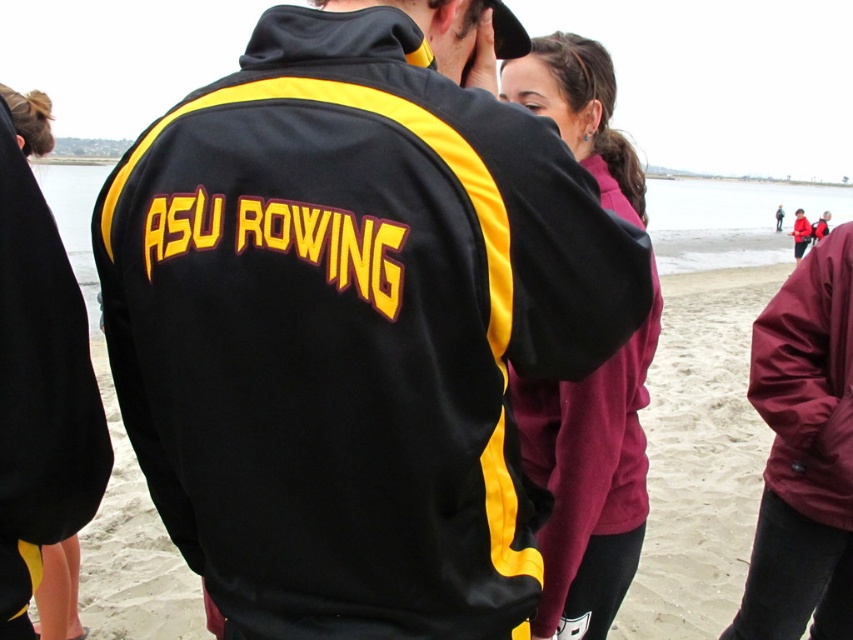
Between black/yellow track jacket at center and maroon fabric jacket at right, which one appears on the left side from the viewer's perspective?

black/yellow track jacket at center is more to the left.

Is black/yellow track jacket at center smaller than maroon fabric jacket at right?

Actually, black/yellow track jacket at center might be larger than maroon fabric jacket at right.

Is point (310, 358) farther from viewer compared to point (820, 262)?

No, it is not.

Where is `black/yellow track jacket at center`? This screenshot has height=640, width=853. black/yellow track jacket at center is located at coordinates (355, 321).

At what (x,y) coordinates should I click in order to perform the action: click on sandy beach at center. Please return your answer as a coordinate pair (x, y). The height and width of the screenshot is (640, 853). Looking at the image, I should click on (700, 458).

Does sandy beach at center have a lesser height compared to maroon fabric jacket at right?

Incorrect, sandy beach at center's height does not fall short of maroon fabric jacket at right's.

Find the location of a particular element. This screenshot has width=853, height=640. sandy beach at center is located at coordinates (700, 458).

Where is `sandy beach at center`? The height and width of the screenshot is (640, 853). sandy beach at center is located at coordinates (700, 458).

Which is below, maroon fleece jacket at center or maroon fabric jacket at right?

Positioned lower is maroon fabric jacket at right.

Can you confirm if maroon fleece jacket at center is positioned below maroon fabric jacket at right?

No, maroon fleece jacket at center is not below maroon fabric jacket at right.

You are a GUI agent. You are given a task and a screenshot of the screen. Output one action in this format:
    pyautogui.click(x=<x>, y=<y>)
    Task: Click on the maroon fleece jacket at center
    Image resolution: width=853 pixels, height=640 pixels.
    Given the screenshot: What is the action you would take?
    pyautogui.click(x=589, y=483)

Where is `maroon fleece jacket at center`? maroon fleece jacket at center is located at coordinates point(589,483).